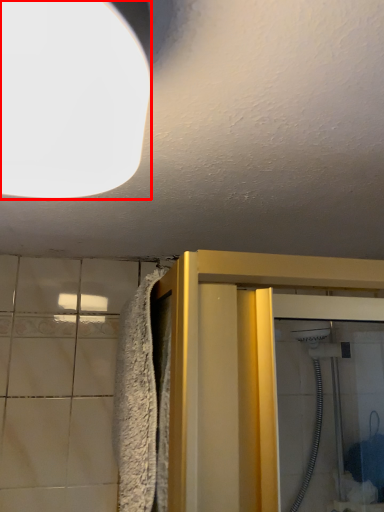
Question: From the image's perspective, what is the correct spatial positioning of lighting (annotated by the red box) in reference to bath towel?

Choices:
 (A) below
 (B) above

Answer: (B)